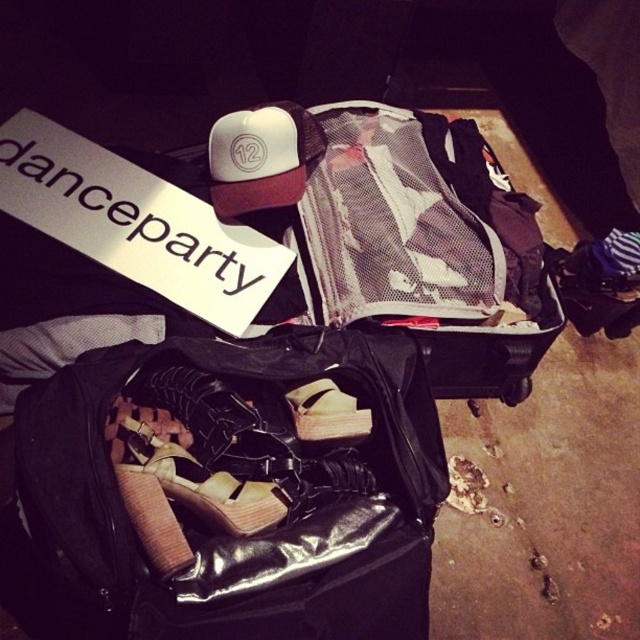
Does black shiny fabric suitcase at lower left have a lesser height compared to brown leather shoe at center?

Incorrect, black shiny fabric suitcase at lower left's height does not fall short of brown leather shoe at center's.

Who is lower down, black shiny fabric suitcase at lower left or brown leather shoe at center?

Result: black shiny fabric suitcase at lower left is below.

Is point (188, 611) less distant than point (310, 438)?

Yes, it is.

Find the location of a particular element. This screenshot has width=640, height=640. black shiny fabric suitcase at lower left is located at coordinates (227, 492).

Between matte black suitcase at center and brown leather shoe at center, which one has less height?

brown leather shoe at center

Does matte black suitcase at center have a lesser height compared to brown leather shoe at center?

Incorrect, matte black suitcase at center's height does not fall short of brown leather shoe at center's.

Locate an element on the screen. The image size is (640, 640). matte black suitcase at center is located at coordinates (401, 234).

Between point (81, 172) and point (323, 422), which one is positioned in front?

Point (323, 422) is more forward.

Who is shorter, white paper sign at upper left or brown leather shoe at center?

brown leather shoe at center

Describe the element at coordinates (134, 221) in the screenshot. I see `white paper sign at upper left` at that location.

This screenshot has height=640, width=640. What are the coordinates of `white paper sign at upper left` in the screenshot? It's located at (134, 221).